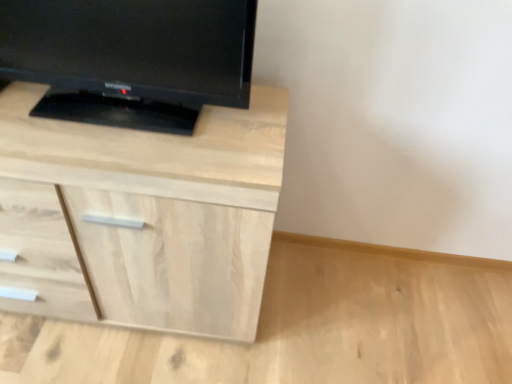
I want to click on vacant space underneath matte black tv at upper left (from a real-world perspective), so click(119, 109).